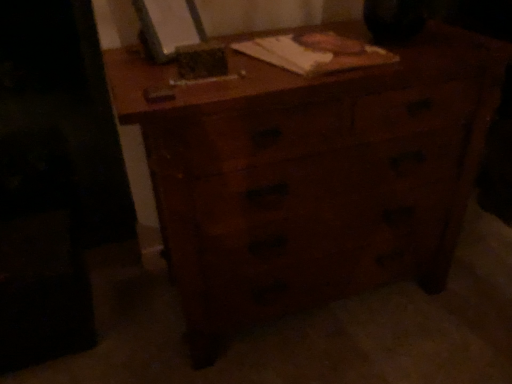
Question: Is point (492, 110) positioned closer to the camera than point (311, 51)?

Choices:
 (A) closer
 (B) farther

Answer: (B)

Question: Considering the positions of wooden chest of drawers at center and wooden notebook at center in the image, is wooden chest of drawers at center wider or thinner than wooden notebook at center?

Choices:
 (A) wide
 (B) thin

Answer: (A)

Question: Considering the positions of wooden chest of drawers at center and wooden notebook at center in the image, is wooden chest of drawers at center taller or shorter than wooden notebook at center?

Choices:
 (A) short
 (B) tall

Answer: (B)

Question: From a real-world perspective, is wooden notebook at center physically located above or below wooden chest of drawers at center?

Choices:
 (A) above
 (B) below

Answer: (A)

Question: From the image's perspective, relative to wooden chest of drawers at center, is wooden notebook at center above or below?

Choices:
 (A) above
 (B) below

Answer: (A)

Question: From their relative heights in the image, would you say wooden notebook at center is taller or shorter than wooden chest of drawers at center?

Choices:
 (A) tall
 (B) short

Answer: (B)

Question: Is wooden notebook at center inside the boundaries of wooden chest of drawers at center, or outside?

Choices:
 (A) inside
 (B) outside

Answer: (A)